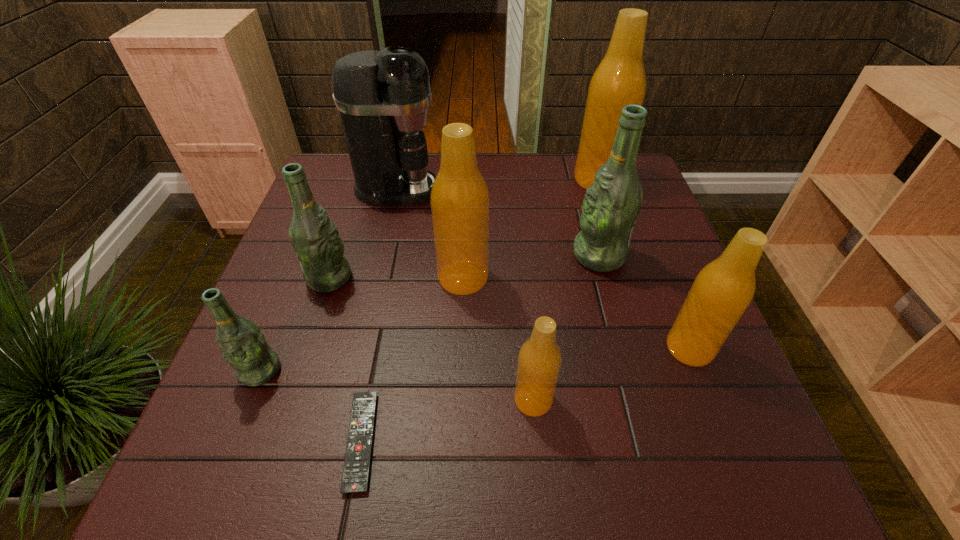
Identify the location of free location that satisfies the following two spatial constraints: 1. on the back side of the leftmost tan beer bottle; 2. on the right side of the biggest tan beer bottle. (467, 180).

Locate an element on the screen. The image size is (960, 540). vacant space that satisfies the following two spatial constraints: 1. on the surface of the second smallest green beer bottle; 2. on the right side of the fourth beer bottle from left to right is located at coordinates (289, 400).

I want to click on free spot that satisfies the following two spatial constraints: 1. on the front side of the farthest tan beer bottle; 2. place cup under the spout of the coffee maker, so click(600, 189).

Where is `vacant space that satisfies the following two spatial constraints: 1. place cup under the spout of the shortest object; 2. on the right side of the coffee maker`? The image size is (960, 540). vacant space that satisfies the following two spatial constraints: 1. place cup under the spout of the shortest object; 2. on the right side of the coffee maker is located at coordinates 341,441.

Find the location of a particular element. free space that satisfies the following two spatial constraints: 1. on the surface of the second nearest tan beer bottle; 2. on the left side of the biggest green beer bottle is located at coordinates (624, 348).

The width and height of the screenshot is (960, 540). In order to click on free space that satisfies the following two spatial constraints: 1. place cup under the spout of the coffee maker; 2. on the back side of the third beer bottle from left to right in this screenshot , I will do `click(377, 278)`.